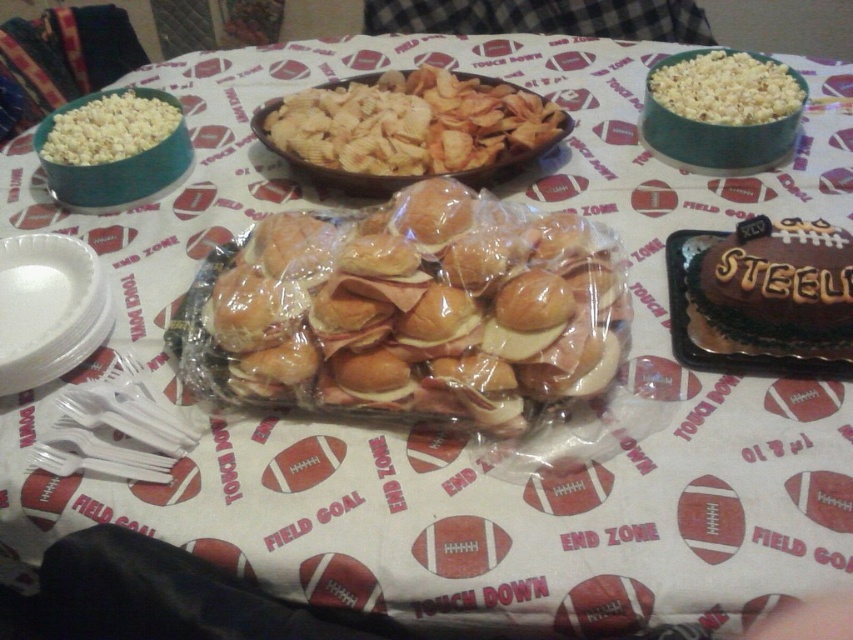
Is white popcorn at upper right thinner than white popcorn at upper left?

No.

Between point (680, 97) and point (82, 148), which one is positioned in front?

Point (82, 148)

This screenshot has height=640, width=853. Find the location of `white popcorn at upper right`. white popcorn at upper right is located at coordinates (726, 88).

Does white paper plate at left appear on the left side of white popcorn at upper right?

Indeed, white paper plate at left is positioned on the left side of white popcorn at upper right.

Can you confirm if white paper plate at left is smaller than white popcorn at upper right?

Indeed, white paper plate at left has a smaller size compared to white popcorn at upper right.

Which is in front, point (90, 294) or point (697, 68)?

Point (90, 294) is in front.

I want to click on white paper plate at left, so click(49, 308).

Is brown crispy chips at center bigger than white popcorn at upper left?

Indeed, brown crispy chips at center has a larger size compared to white popcorn at upper left.

Is point (392, 160) in front of point (160, 131)?

Yes, point (392, 160) is in front of point (160, 131).

Is point (527, 104) less distant than point (132, 140)?

No, (527, 104) is behind (132, 140).

Identify the location of brown crispy chips at center. The image size is (853, 640). (416, 125).